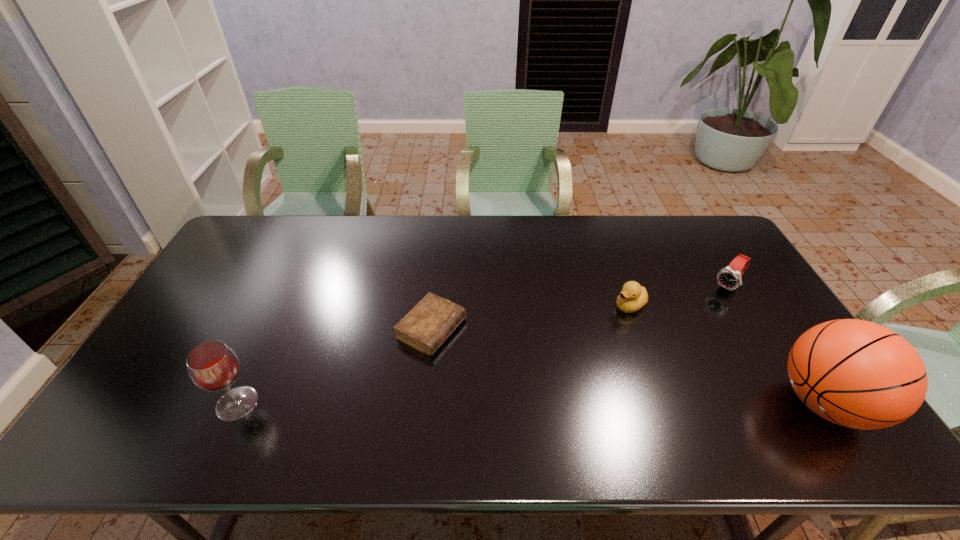
I want to click on wineglass, so click(213, 366).

At what (x,y) coordinates should I click in order to perform the action: click on the fourth shortest object. Please return your answer as a coordinate pair (x, y). Image resolution: width=960 pixels, height=540 pixels. Looking at the image, I should click on (213, 366).

Image resolution: width=960 pixels, height=540 pixels. What are the coordinates of `basketball` in the screenshot? It's located at (858, 374).

Find the location of `watch`. watch is located at coordinates (729, 277).

I want to click on duckling, so click(x=633, y=296).

Find the location of `the shortest object`. the shortest object is located at coordinates (425, 327).

Find the location of a particular element. The height and width of the screenshot is (540, 960). diary is located at coordinates (425, 327).

You are a GUI agent. You are given a task and a screenshot of the screen. Output one action in this format:
    pyautogui.click(x=<x>, y=<y>)
    Task: Click on the free location located 0.140m on the right of the leftmost object
    
    Given the screenshot: What is the action you would take?
    pyautogui.click(x=314, y=403)

Identify the location of vacant space located 0.190m on the back of the basketball. (765, 311).

The width and height of the screenshot is (960, 540). I want to click on vacant space located 0.110m on the face of the watch, so click(704, 313).